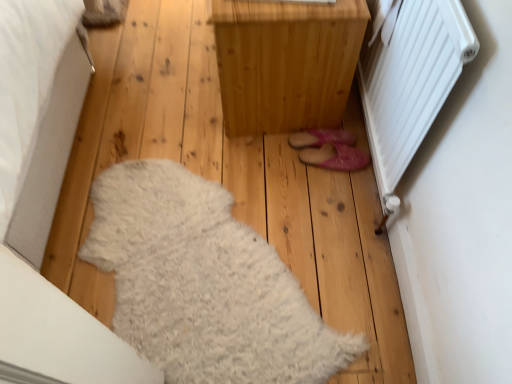
At what (x,y) coordinates should I click in order to perform the action: click on vacant space to the left of pink fuzzy slippers at center. Please return your answer as a coordinate pair (x, y). Looking at the image, I should click on (246, 164).